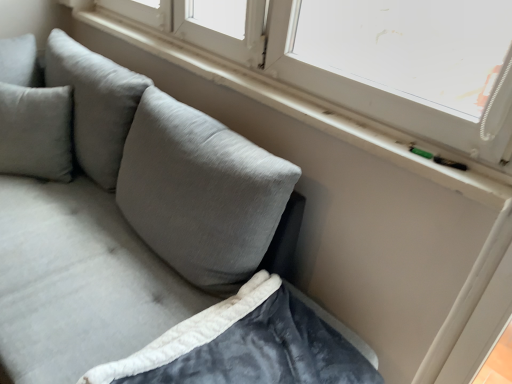
You are a GUI agent. You are given a task and a screenshot of the screen. Output one action in this format:
    pyautogui.click(x=<x>, y=<y>)
    Task: Click on the vacant space underneath white plastic window at upper right (from a real-world perspective)
    This screenshot has height=384, width=512.
    Given the screenshot: What is the action you would take?
    pyautogui.click(x=256, y=83)